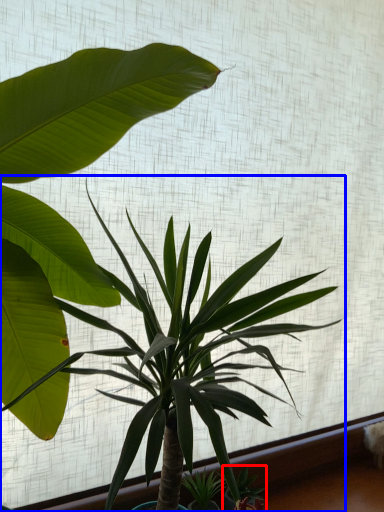
Question: Which of the following is the closest to the observer, plant (highlighted by a red box) or houseplant (highlighted by a blue box)?

Choices:
 (A) plant
 (B) houseplant

Answer: (B)